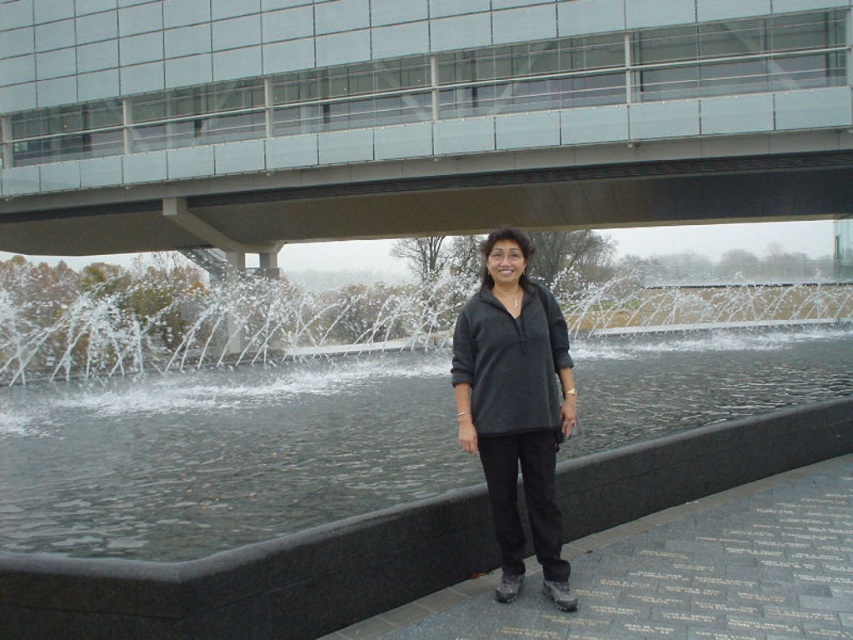
Question: Is clear water at center thinner than dark gray fleece at center?

Choices:
 (A) yes
 (B) no

Answer: (B)

Question: Among these points, which one is farthest from the camera?

Choices:
 (A) (471, 332)
 (B) (236, 522)

Answer: (B)

Question: Among these points, which one is farthest from the camera?

Choices:
 (A) (465, 444)
 (B) (93, 508)

Answer: (B)

Question: Does clear water at center come behind dark gray fleece at center?

Choices:
 (A) no
 (B) yes

Answer: (B)

Question: Does clear water at center have a smaller size compared to dark gray fleece at center?

Choices:
 (A) yes
 (B) no

Answer: (B)